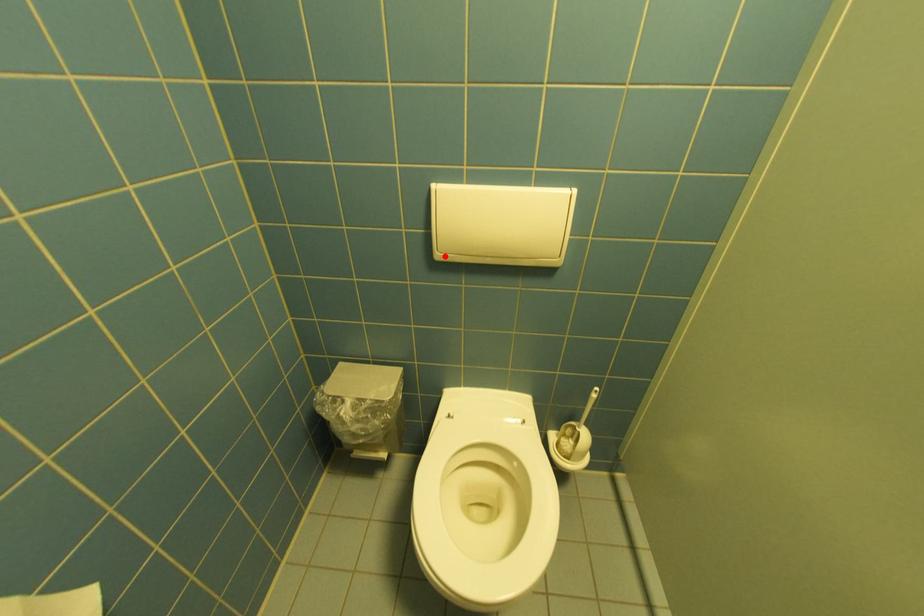
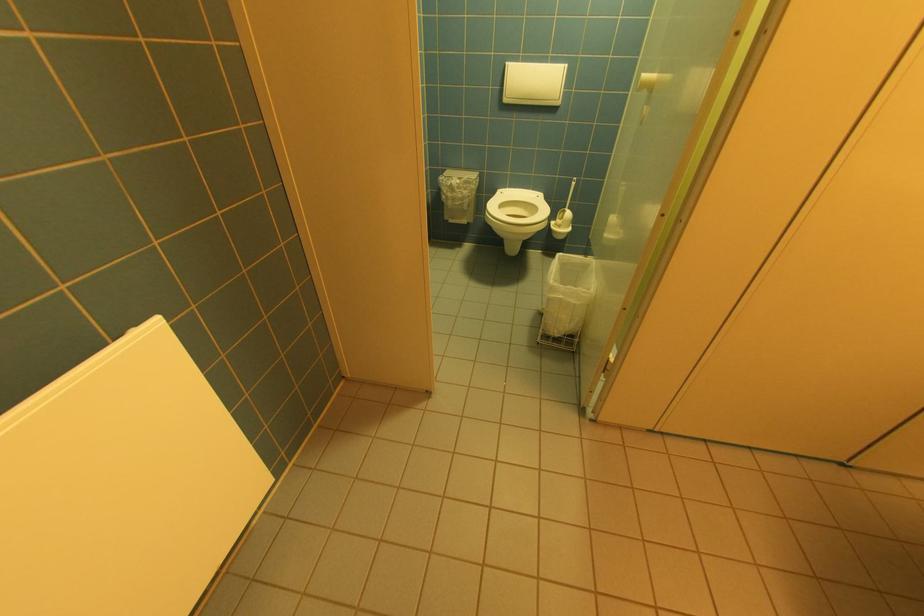
Question: I am providing you with two images of the same scene from different viewpoints. A red point is shown in image1. For the corresponding object point in image2, is it positioned nearer or farther from the camera?

Choices:
 (A) Nearer
 (B) Farther

Answer: (A)